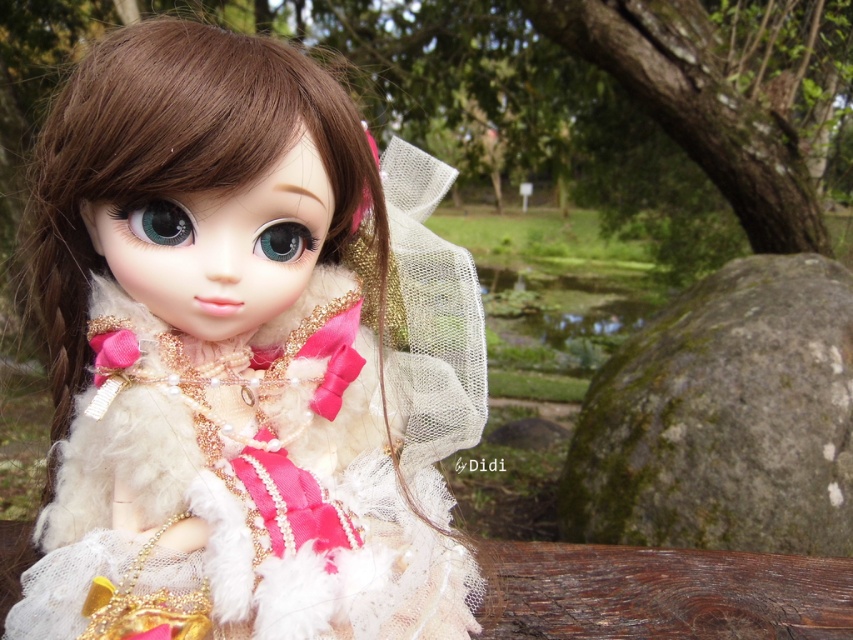
Is fuzzy white dress at center below green mossy rock at lower right?

Actually, fuzzy white dress at center is above green mossy rock at lower right.

Which is more to the right, fuzzy white dress at center or green mossy rock at lower right?

green mossy rock at lower right

Is point (354, 570) closer to camera compared to point (786, 467)?

Yes, point (354, 570) is in front of point (786, 467).

Find the location of a particular element. The width and height of the screenshot is (853, 640). fuzzy white dress at center is located at coordinates (244, 355).